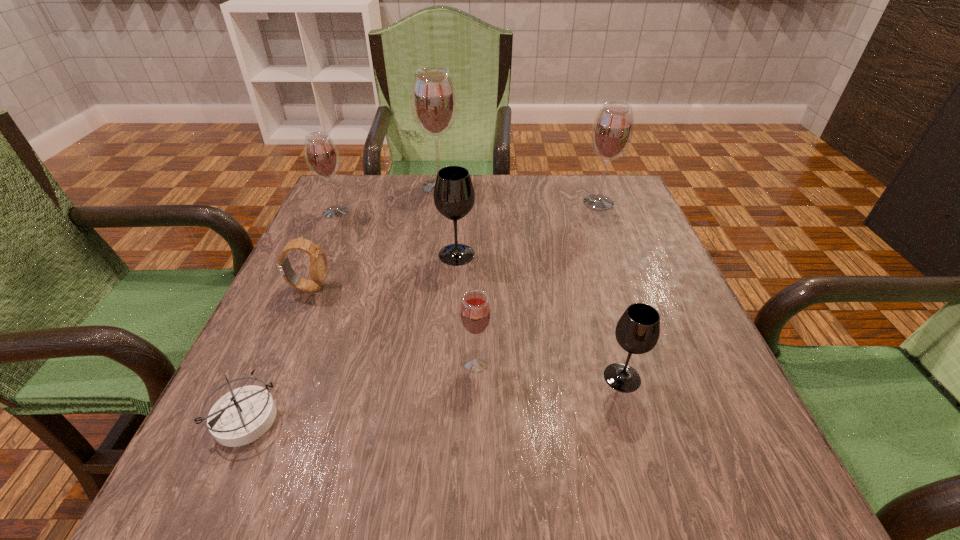
This screenshot has height=540, width=960. What are the coordinates of `free space located on the left of the smaller gray wineglass` in the screenshot? It's located at (462, 377).

In order to click on vacant space positioned 0.380m on the face of the watch in this screenshot , I will do `click(511, 287)`.

Where is `vacant space located on the back of the compass`? The image size is (960, 540). vacant space located on the back of the compass is located at coordinates (307, 281).

Image resolution: width=960 pixels, height=540 pixels. In order to click on object that is at the near edge in this screenshot , I will do [243, 415].

At what (x,y) coordinates should I click in order to perform the action: click on wineglass situated at the left edge. Please return your answer as a coordinate pair (x, y). Looking at the image, I should click on (321, 155).

The height and width of the screenshot is (540, 960). What are the coordinates of `watch situated at the left edge` in the screenshot? It's located at (318, 265).

At what (x,y) coordinates should I click in order to perform the action: click on compass at the left edge. Please return your answer as a coordinate pair (x, y). This screenshot has width=960, height=540. Looking at the image, I should click on (243, 415).

This screenshot has height=540, width=960. I want to click on object that is at the far left corner, so click(x=321, y=155).

Image resolution: width=960 pixels, height=540 pixels. I want to click on object that is at the near left corner, so click(x=243, y=415).

The image size is (960, 540). I want to click on object that is at the far right corner, so click(612, 131).